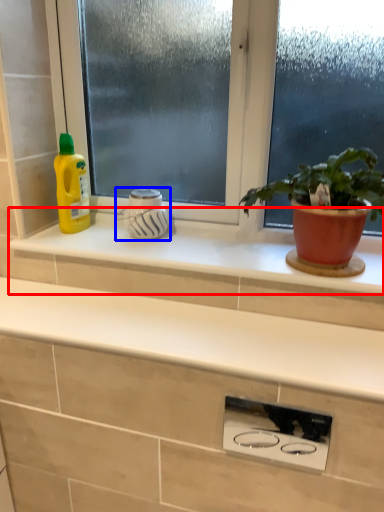
Question: Which object is further to the camera taking this photo, window sill (highlighted by a red box) or appliance (highlighted by a blue box)?

Choices:
 (A) window sill
 (B) appliance

Answer: (B)